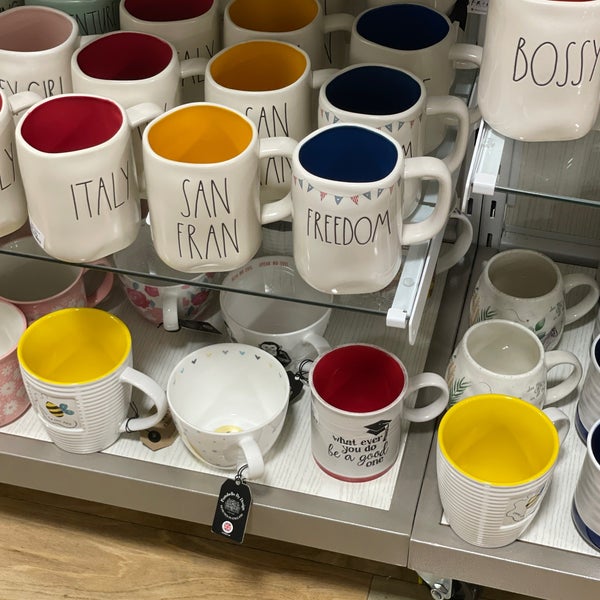
The image size is (600, 600). I want to click on castor wheels, so click(427, 595).